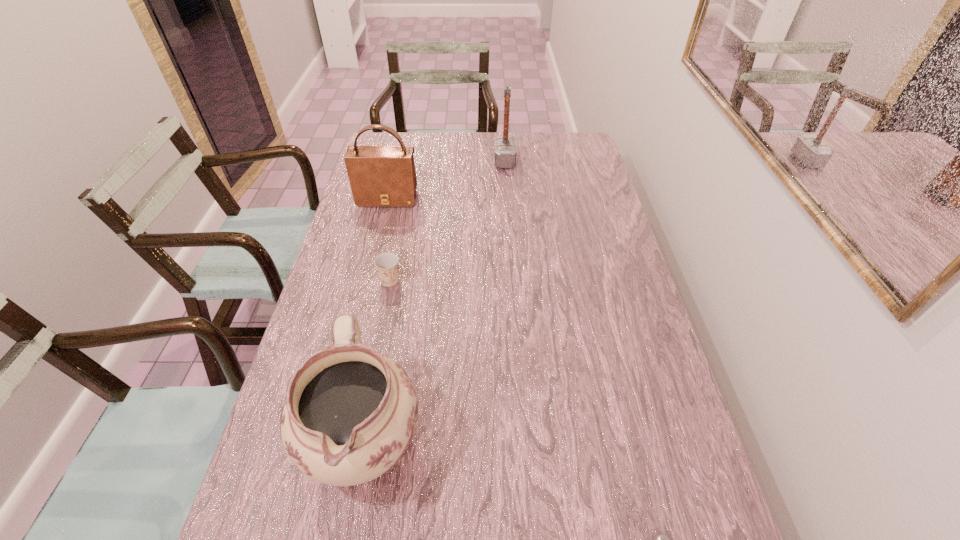
You are a GUI agent. You are given a task and a screenshot of the screen. Output one action in this format:
    pyautogui.click(x=<x>, y=<y>)
    Task: Click on the farther hammer
    This screenshot has width=960, height=540.
    Given the screenshot: What is the action you would take?
    pyautogui.click(x=505, y=152)

You are a GUI agent. You are given a task and a screenshot of the screen. Output one action in this format:
    pyautogui.click(x=<x>, y=<y>)
    Task: Click on the taller hammer
    The height and width of the screenshot is (540, 960).
    Given the screenshot: What is the action you would take?
    pyautogui.click(x=505, y=152)

This screenshot has width=960, height=540. I want to click on the fourth nearest object, so click(x=380, y=176).

In order to click on the second nearest object in this screenshot , I will do 350,413.

Where is `Dixie cup`? The height and width of the screenshot is (540, 960). Dixie cup is located at coordinates (386, 263).

You are a GUI agent. You are given a task and a screenshot of the screen. Output one action in this format:
    pyautogui.click(x=<x>, y=<y>)
    Task: Click on the third nearest object
    This screenshot has height=540, width=960.
    Given the screenshot: What is the action you would take?
    pyautogui.click(x=386, y=263)

Find the location of a particular element. free space located on the striking surface of the farthest object is located at coordinates (474, 161).

Find the location of a particular element. vacant space located on the striking surface of the farthest object is located at coordinates (431, 161).

Where is `blank space located on the striking surface of the farthest object`? The height and width of the screenshot is (540, 960). blank space located on the striking surface of the farthest object is located at coordinates (413, 161).

In order to click on free spot located on the front flap of the shoulder bag in this screenshot , I will do `click(364, 295)`.